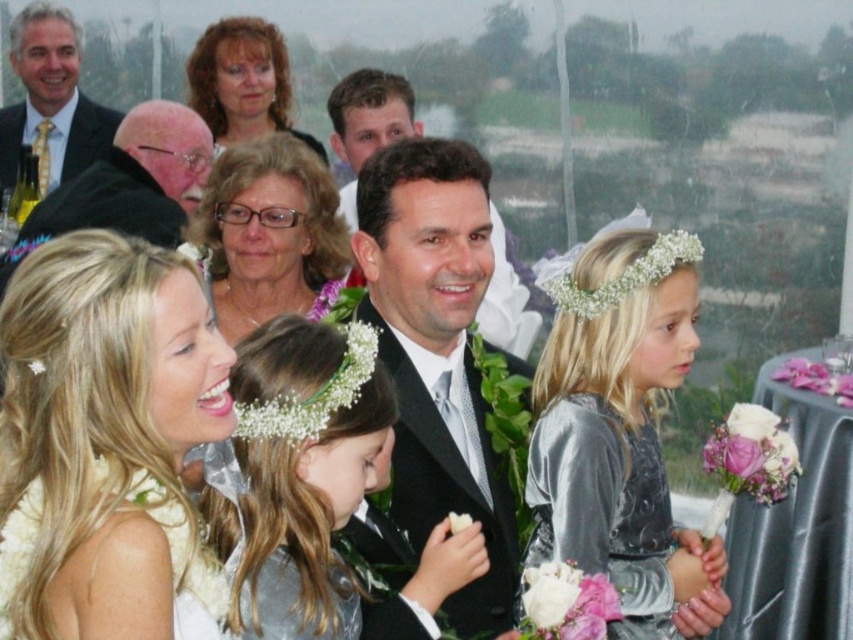
You are a photographer at the wedding reception and need to capture a photo that includes both the matte silver hair at center and the white satin dress at lower left. Based on their positions, which object should be placed higher in the frame to ensure both are fully visible?

The matte silver hair at center is taller than the white satin dress at lower left, so to ensure both are fully visible, the matte silver hair at center should be placed higher in the frame.